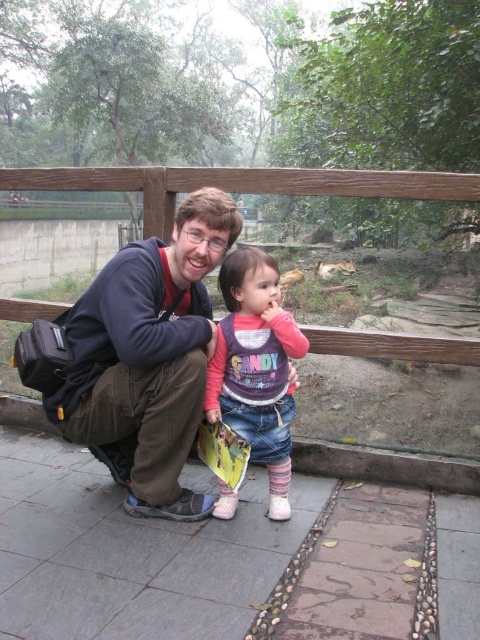
You are a photographer trying to capture a photo of both the matte blue jacket at center and the matte purple sweater at center. Since you want both subjects to be in focus, you need to know which one is closer to you. Can you determine which one is nearer?

The matte blue jacket at center is closer to the viewer than the matte purple sweater at center, so you should focus on the matte blue jacket at center first to ensure both are in focus.

You are a zoo visitor trying to decide which of the two jackets to wear for your visit. The zoo requires that the jacket must be larger than the sweater you are wearing. Given the matte blue jacket at center and the matte purple sweater at center, which jacket should you choose?

The matte blue jacket at center is bigger than the matte purple sweater at center, so you should choose the matte blue jacket at center to meet the zoo requirement.

You are a photographer standing at the entrance of the zoo. You see the matte blue jacket at center. Can you take a clear photo of it from your current position?

The matte blue jacket at center is 6.80 feet away from viewer, so yes, you can take a clear photo of it from your current position as it is within a reasonable distance for photography.